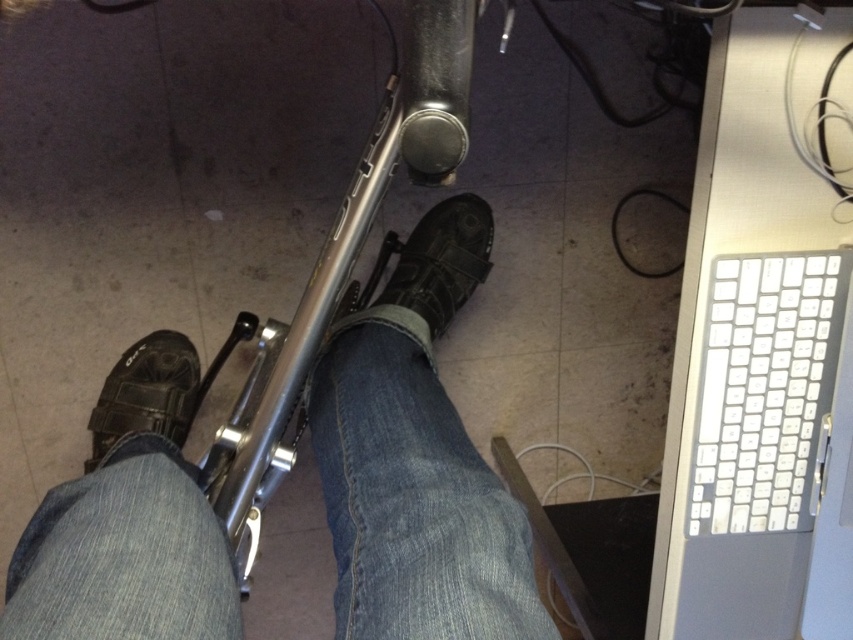
Question: Does white plastic keyboard at right appear under black suede shoe at lower left?

Choices:
 (A) no
 (B) yes

Answer: (A)

Question: Based on their relative distances, which object is nearer to the matte black shoe at center?

Choices:
 (A) leather boot at center
 (B) denim at center

Answer: (B)

Question: Is denim at center positioned at the back of black suede shoe at lower left?

Choices:
 (A) no
 (B) yes

Answer: (A)

Question: Is denim at center smaller than leather boot at center?

Choices:
 (A) no
 (B) yes

Answer: (A)

Question: Among these objects, which one is farthest from the camera?

Choices:
 (A) denim at left
 (B) black suede shoe at lower left
 (C) matte black shoe at center

Answer: (B)

Question: Which object is the farthest from the white plastic keyboard at right?

Choices:
 (A) denim at center
 (B) leather boot at center

Answer: (B)